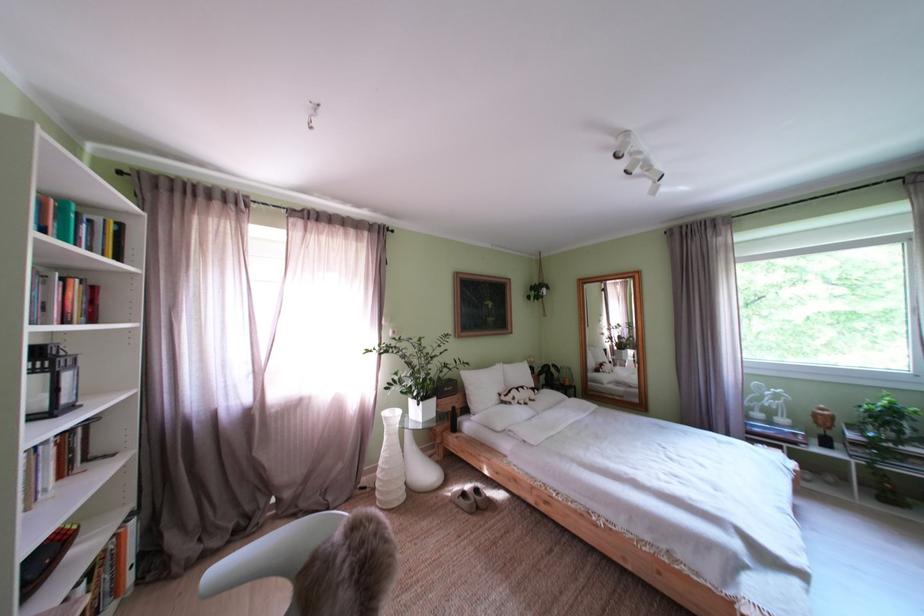
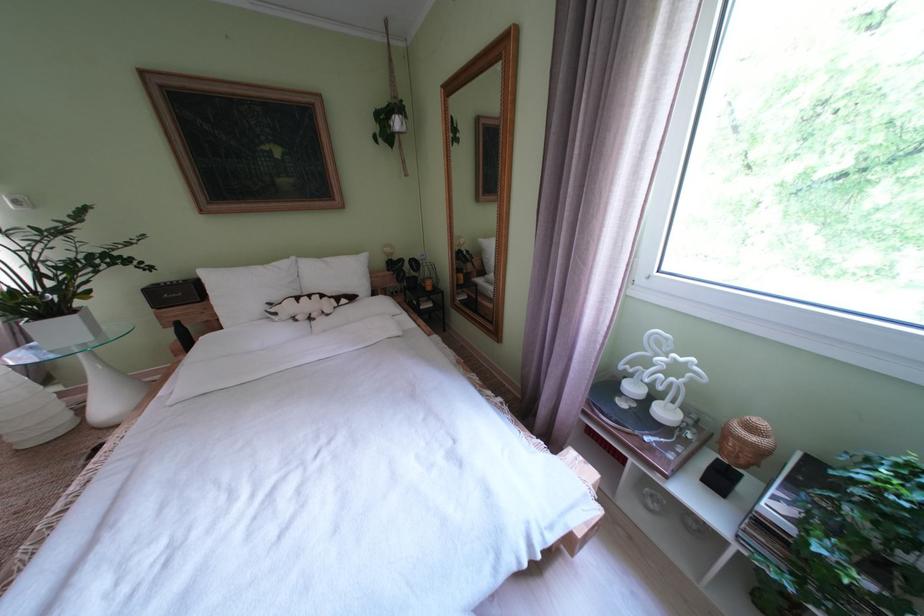
Which direction would the cameraman need to move to produce the second image?

The cameraman walked toward right, forward.